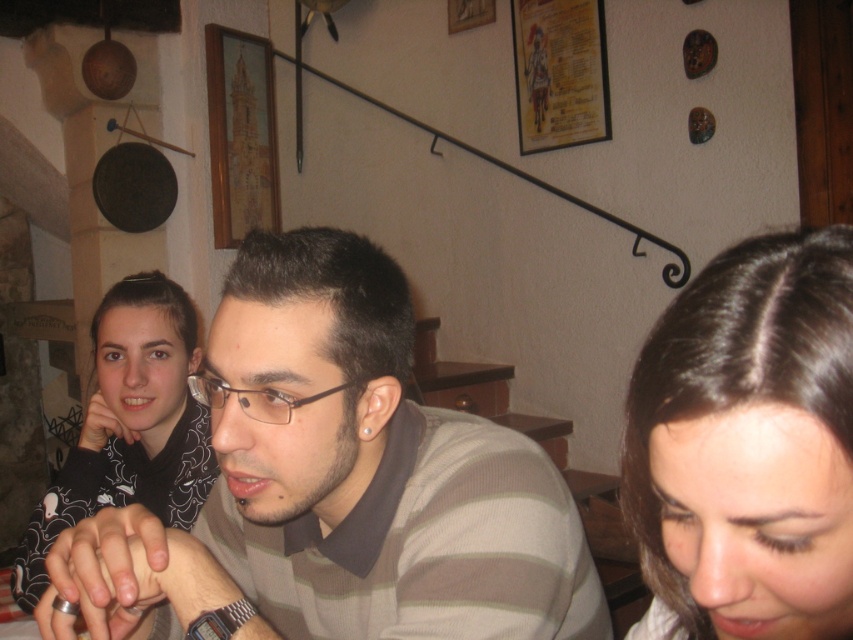
Question: Is striped cotton shirt at center to the left of dark brown hair at lower right from the viewer's perspective?

Choices:
 (A) yes
 (B) no

Answer: (A)

Question: Based on their relative distances, which object is farther from the dark brown hair at lower right?

Choices:
 (A) striped cotton shirt at center
 (B) black matte shirt at left

Answer: (B)

Question: Among these points, which one is farthest from the camera?

Choices:
 (A) (350, 634)
 (B) (119, 317)
 (C) (735, 608)

Answer: (B)

Question: Observing the image, what is the correct spatial positioning of striped cotton shirt at center in reference to black matte shirt at left?

Choices:
 (A) below
 (B) above

Answer: (A)

Question: Which object is closer to the camera taking this photo?

Choices:
 (A) black matte shirt at left
 (B) striped cotton shirt at center
 (C) dark brown hair at lower right

Answer: (C)

Question: Is striped cotton shirt at center wider than black matte shirt at left?

Choices:
 (A) no
 (B) yes

Answer: (B)